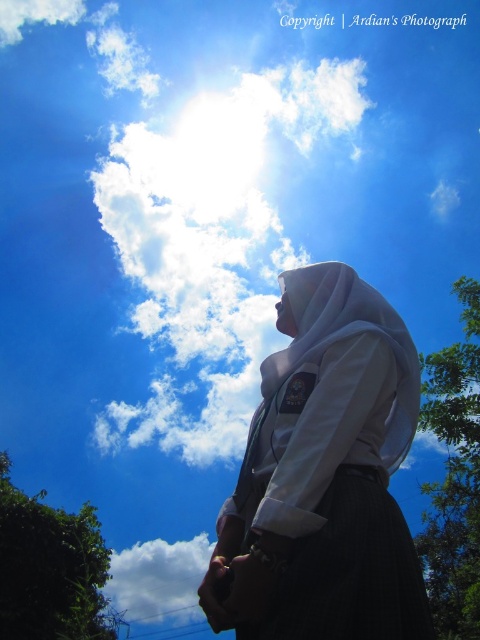
Who is more distant from viewer, (271,628) or (144,589)?

The point (144,589) is more distant.

Consider the image. Is white matte uniform at center smaller than white fluffy cloud at lower left?

Yes, white matte uniform at center is smaller than white fluffy cloud at lower left.

Between point (369, 340) and point (194, 612), which one is positioned in front?

Point (369, 340) is in front.

Where is `white matte uniform at center`? white matte uniform at center is located at coordinates (324, 476).